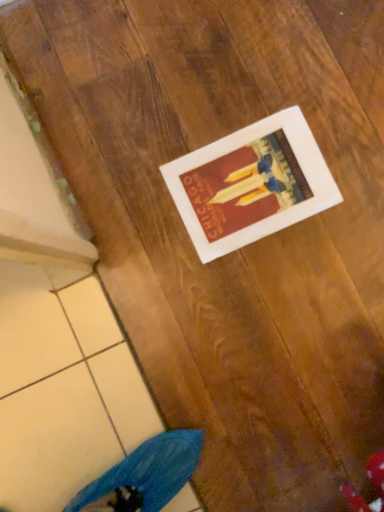
Identify the location of white matte picture frame at center. This screenshot has height=512, width=384. (251, 184).

What do you see at coordinates (251, 184) in the screenshot?
I see `white matte picture frame at center` at bounding box center [251, 184].

This screenshot has width=384, height=512. Identify the location of white matte picture frame at center. (251, 184).